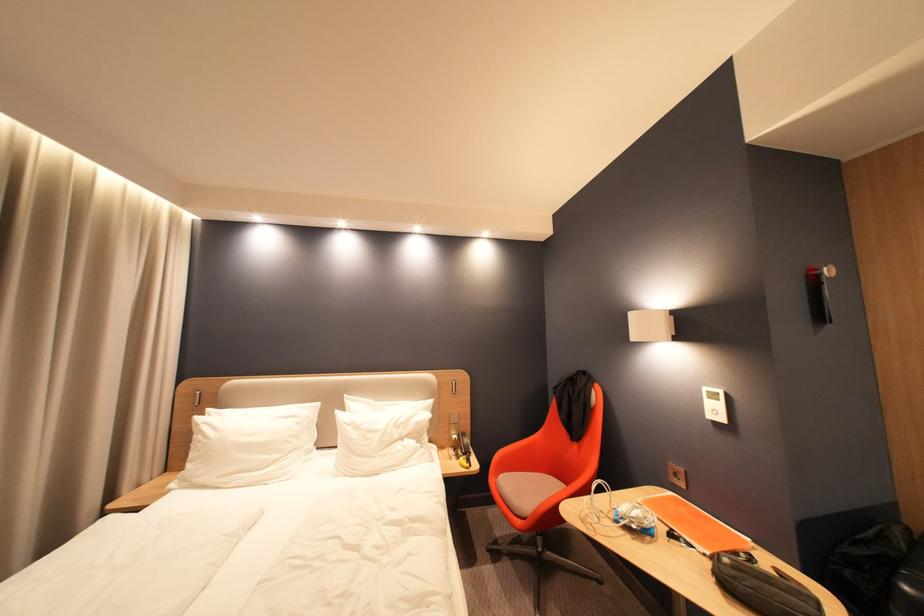
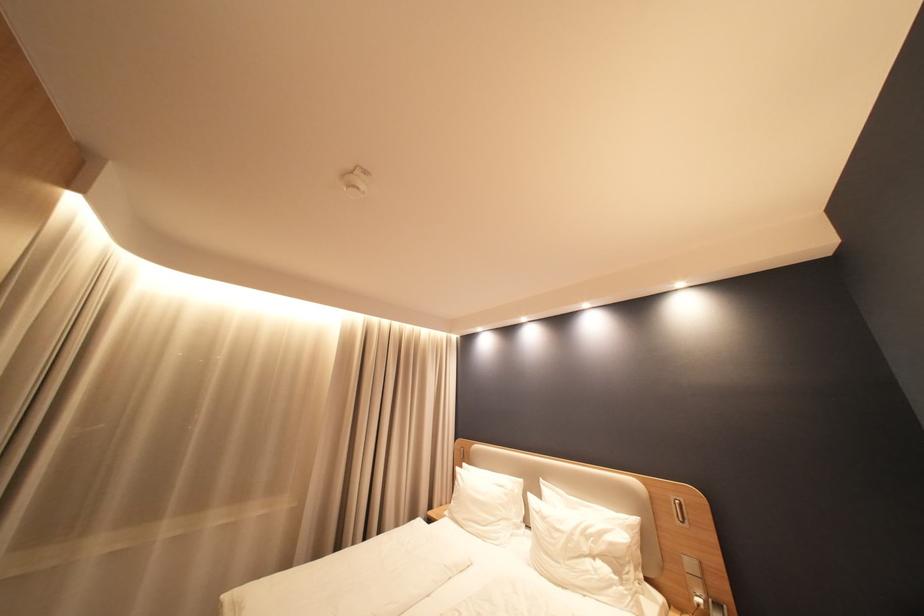
Locate, in the second image, the point that corresponds to (x=458, y=428) in the first image.

(696, 578)